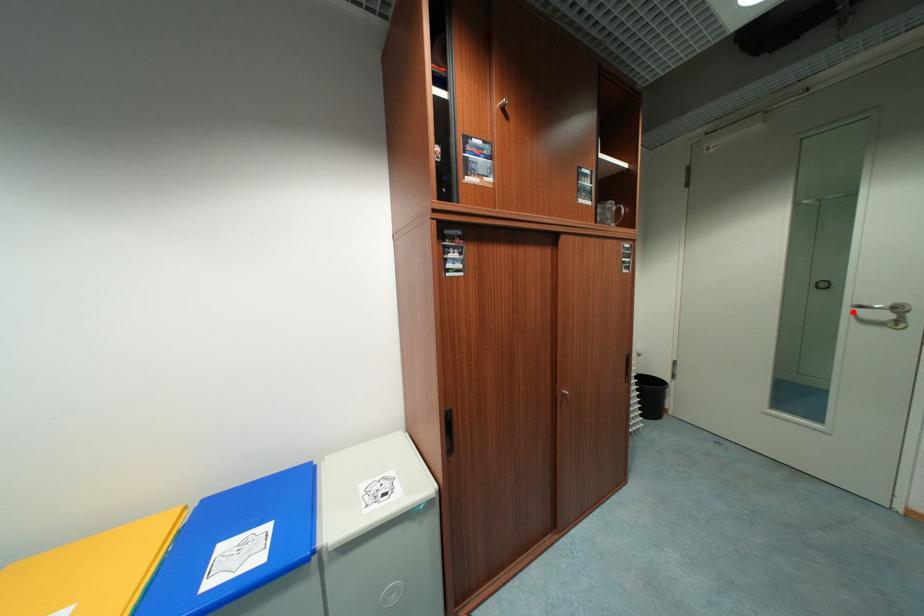
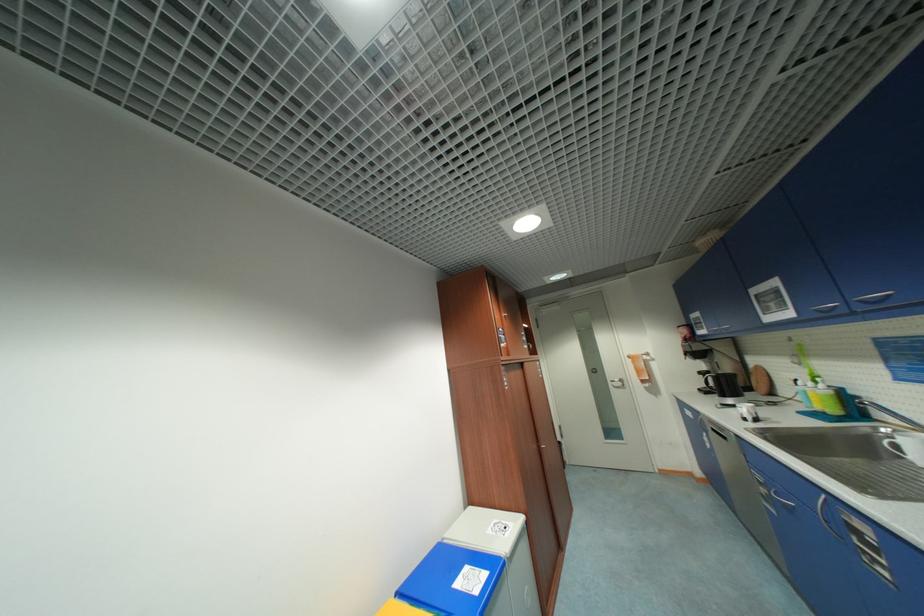
In the second image, find the point that corresponds to the highlighted location in the first image.

(615, 384)